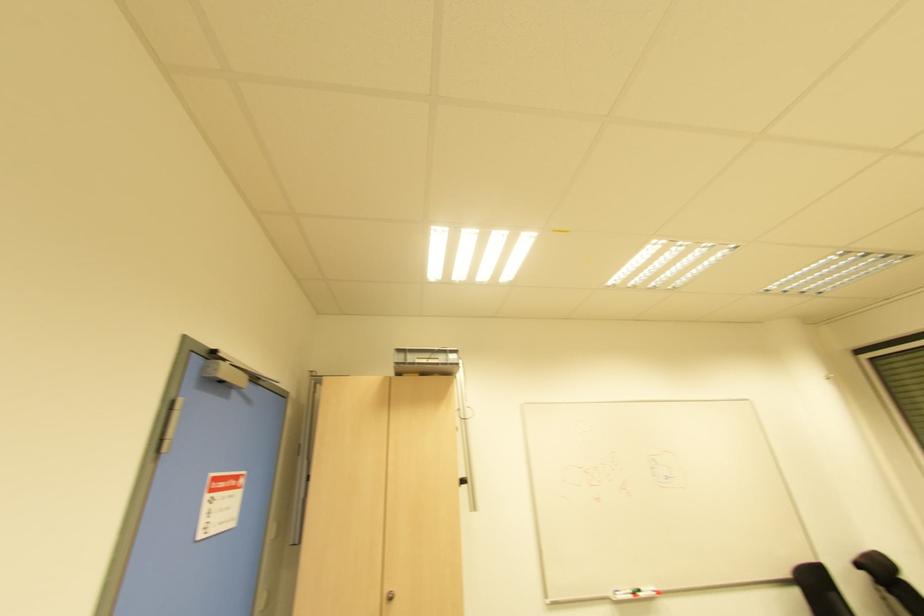
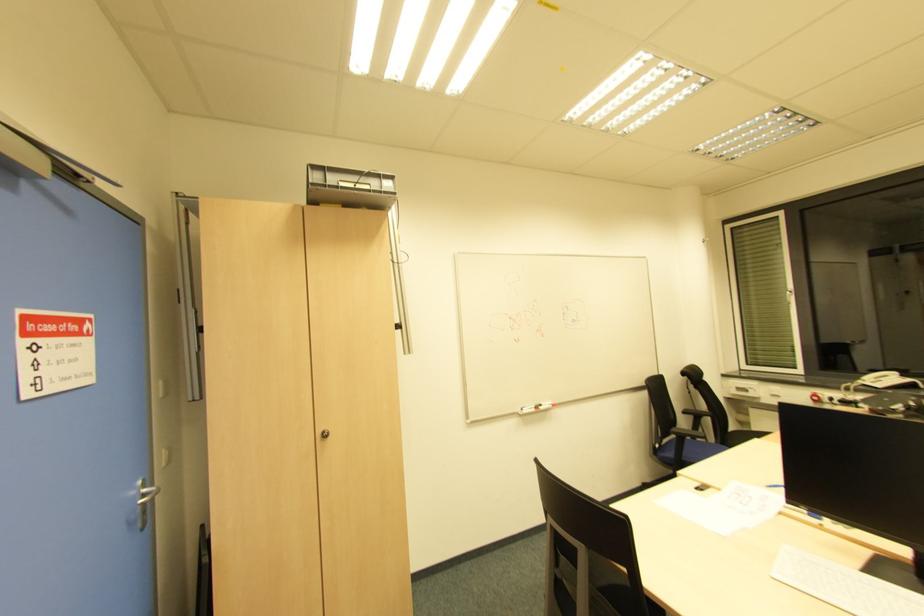
In a continuous first-person perspective shot, in which direction is the camera moving?

The movement direction of the cameraman is left, forward.